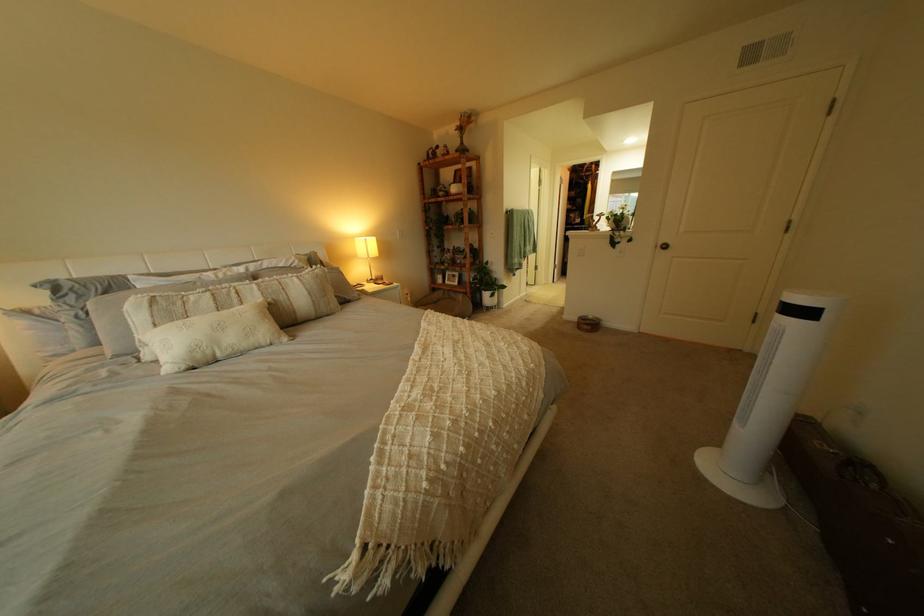
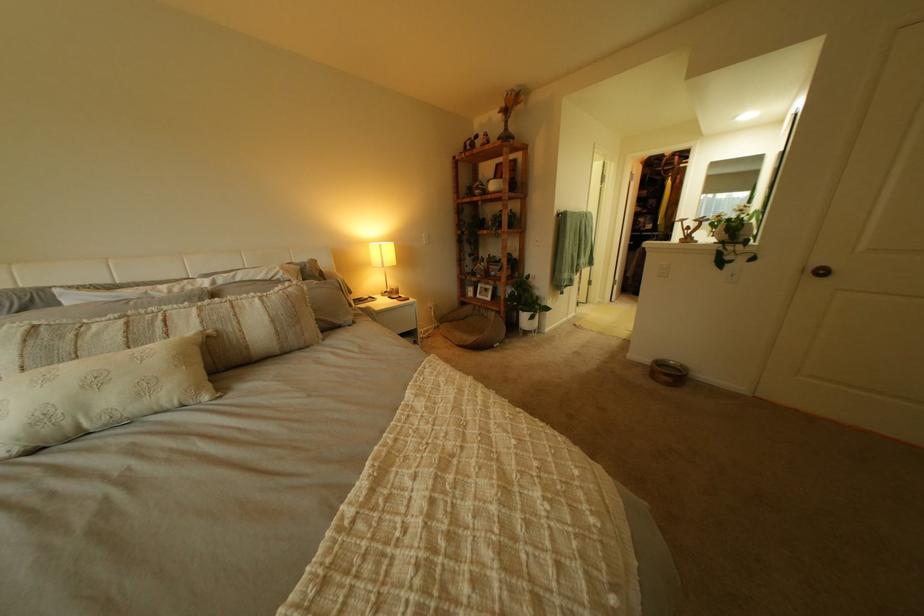
In the second image, find the point that corresponds to pixel 224 353 in the first image.

(80, 424)